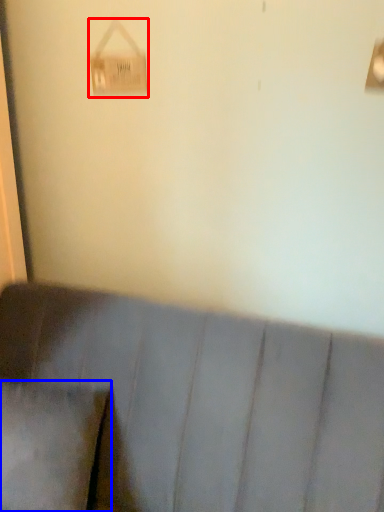
Question: Which point is closer to the camera, lamp (highlighted by a red box) or pillow (highlighted by a blue box)?

Choices:
 (A) lamp
 (B) pillow

Answer: (B)